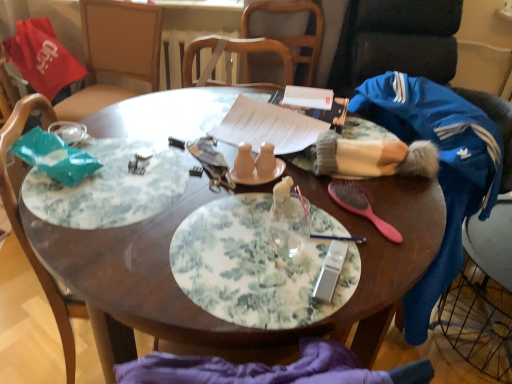
You are a GUI agent. You are given a task and a screenshot of the screen. Output one action in this format:
    pyautogui.click(x=<x>, y=<y>)
    Task: Click on the vacant space to the right of matte ceramic salt and pepper shakers at center, marked as the third tableware in a left-to-right arrangement
    This screenshot has height=384, width=512.
    Given the screenshot: What is the action you would take?
    pyautogui.click(x=332, y=198)